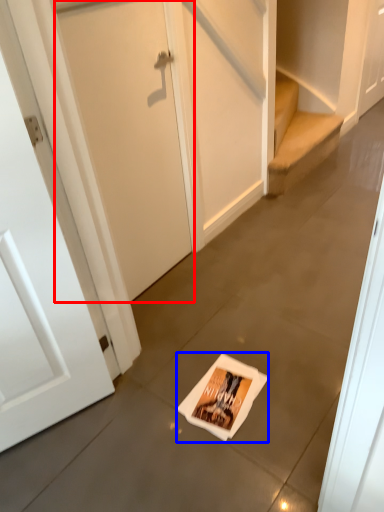
Question: Which object appears farthest to the camera in this image, door (highlighted by a red box) or flyer (highlighted by a blue box)?

Choices:
 (A) door
 (B) flyer

Answer: (B)